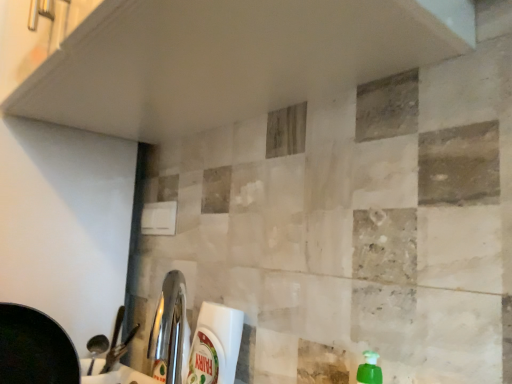
Question: Looking at their shapes, would you say white plastic bottle at lower center is wider or thinner than white glossy countertop at lower left?

Choices:
 (A) wide
 (B) thin

Answer: (B)

Question: Is white plastic bottle at lower center to the left or to the right of white glossy countertop at lower left in the image?

Choices:
 (A) right
 (B) left

Answer: (A)

Question: Is white plastic bottle at lower center spatially inside white glossy countertop at lower left, or outside of it?

Choices:
 (A) inside
 (B) outside

Answer: (B)

Question: In terms of width, does white glossy countertop at lower left look wider or thinner when compared to white plastic bottle at lower center?

Choices:
 (A) wide
 (B) thin

Answer: (A)

Question: Considering their positions, is white glossy countertop at lower left located in front of or behind white plastic bottle at lower center?

Choices:
 (A) front
 (B) behind

Answer: (A)

Question: Looking at the image, does white glossy countertop at lower left seem bigger or smaller compared to white plastic bottle at lower center?

Choices:
 (A) small
 (B) big

Answer: (A)

Question: Is white glossy countertop at lower left inside the boundaries of white plastic bottle at lower center, or outside?

Choices:
 (A) outside
 (B) inside

Answer: (A)